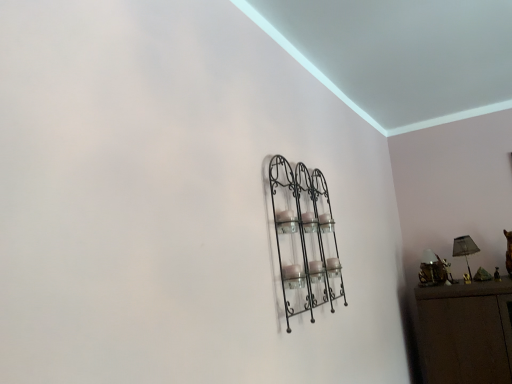
Question: Does black wrought iron shelf at center have a larger size compared to matte black lampshade at right?

Choices:
 (A) yes
 (B) no

Answer: (A)

Question: Is there a large distance between black wrought iron shelf at center and matte black lampshade at right?

Choices:
 (A) no
 (B) yes

Answer: (B)

Question: Considering the relative sizes of black wrought iron shelf at center and matte black lampshade at right in the image provided, is black wrought iron shelf at center shorter than matte black lampshade at right?

Choices:
 (A) yes
 (B) no

Answer: (B)

Question: Is black wrought iron shelf at center to the right of matte black lampshade at right from the viewer's perspective?

Choices:
 (A) yes
 (B) no

Answer: (B)

Question: Is the depth of black wrought iron shelf at center less than that of matte black lampshade at right?

Choices:
 (A) yes
 (B) no

Answer: (A)

Question: Considering the relative sizes of black wrought iron shelf at center and matte black lampshade at right in the image provided, is black wrought iron shelf at center smaller than matte black lampshade at right?

Choices:
 (A) no
 (B) yes

Answer: (A)

Question: Does matte black lampshade at right appear on the right side of black wrought iron shelf at center?

Choices:
 (A) yes
 (B) no

Answer: (A)

Question: Are matte black lampshade at right and black wrought iron shelf at center beside each other?

Choices:
 (A) no
 (B) yes

Answer: (A)

Question: Is matte black lampshade at right wider than black wrought iron shelf at center?

Choices:
 (A) yes
 (B) no

Answer: (A)

Question: Does matte black lampshade at right have a lesser height compared to black wrought iron shelf at center?

Choices:
 (A) no
 (B) yes

Answer: (B)

Question: Is matte black lampshade at right oriented away from black wrought iron shelf at center?

Choices:
 (A) yes
 (B) no

Answer: (B)

Question: Could you tell me if matte black lampshade at right is facing black wrought iron shelf at center?

Choices:
 (A) no
 (B) yes

Answer: (B)

Question: Can you confirm if metallic gold lamp at right is bigger than black wrought iron shelf at center?

Choices:
 (A) no
 (B) yes

Answer: (A)